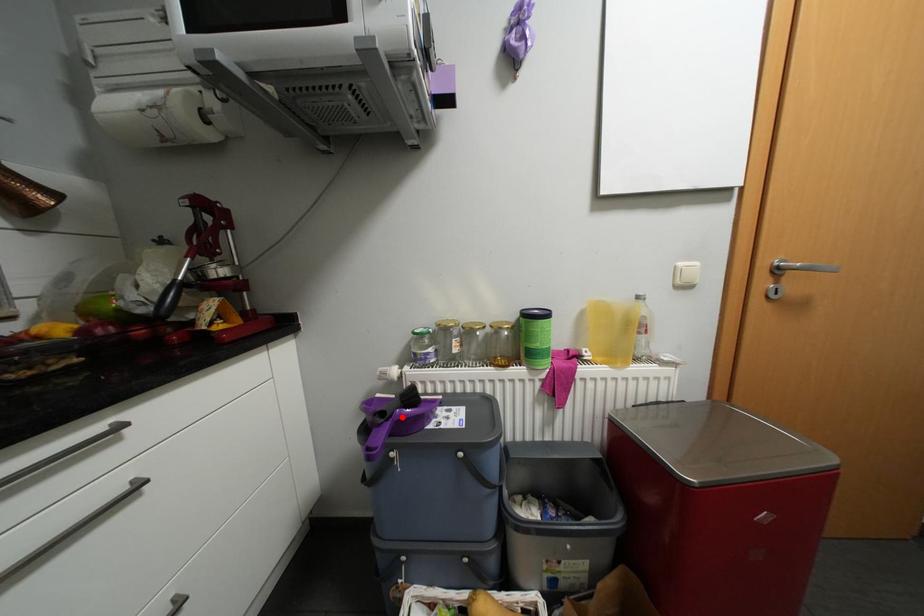
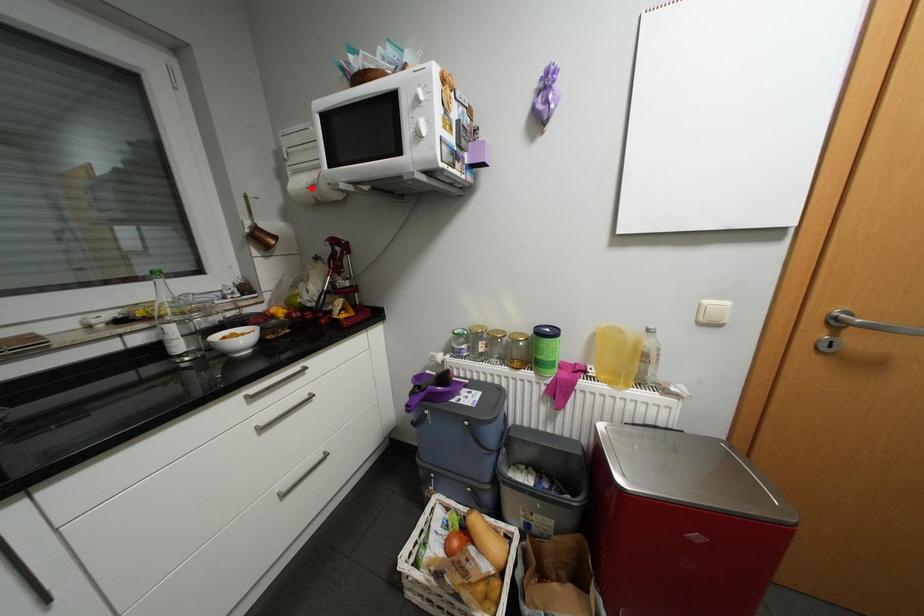
I am providing you with two images of the same scene from different viewpoints. A red point is marked on the first image and another point is marked on the second image. Is the marked point in image1 the same physical position as the marked point in image2?

No